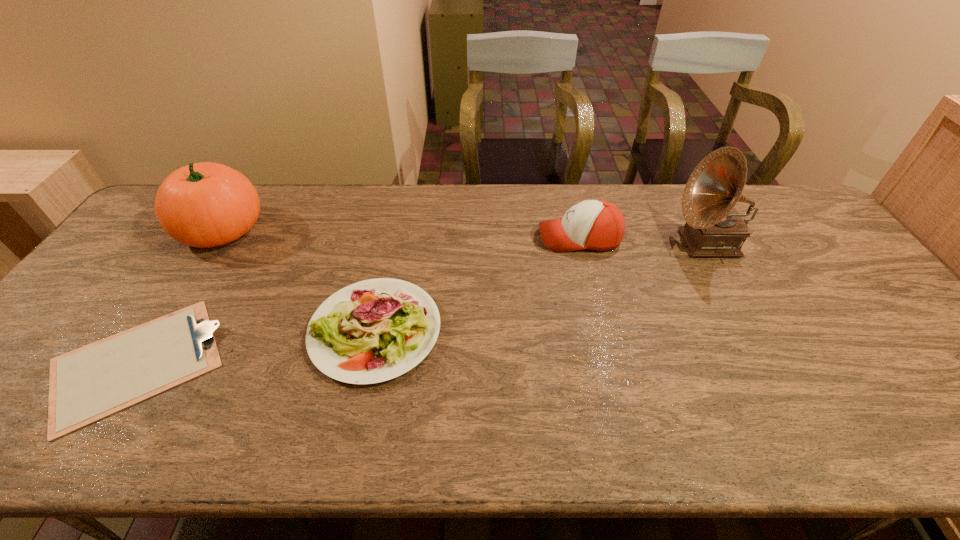
The height and width of the screenshot is (540, 960). I want to click on vacant space at the far edge of the desktop, so click(668, 197).

You are a GUI agent. You are given a task and a screenshot of the screen. Output one action in this format:
    pyautogui.click(x=<x>, y=<y>)
    Task: Click on the free space at the near edge of the desktop
    The image size is (960, 540).
    Given the screenshot: What is the action you would take?
    pyautogui.click(x=815, y=430)

Where is `vacant region at the left edge of the desktop`? This screenshot has width=960, height=540. vacant region at the left edge of the desktop is located at coordinates (106, 292).

Locate an element on the screen. free location at the right edge is located at coordinates (908, 357).

At what (x,y) coordinates should I click in order to perform the action: click on unoccupied area between the salad plate and the third tallest object. Please return your answer as a coordinate pair (x, y). The height and width of the screenshot is (540, 960). Looking at the image, I should click on pos(477,284).

This screenshot has height=540, width=960. What are the coordinates of `vacant space in between the fourth shortest object and the phonograph record` in the screenshot? It's located at (465, 236).

Identify the location of unoccupied position between the phonograph record and the pumpkin. (465, 236).

Where is `free space that is in between the fourth object from left to right and the salad plate`? This screenshot has height=540, width=960. free space that is in between the fourth object from left to right and the salad plate is located at coordinates (477, 284).

At what (x,y) coordinates should I click in order to perform the action: click on empty space that is in between the rightmost object and the second tallest object. Please return your answer as a coordinate pair (x, y). Looking at the image, I should click on (465, 236).

Where is `object that stands as the closest to the rightmost object`? This screenshot has width=960, height=540. object that stands as the closest to the rightmost object is located at coordinates (598, 225).